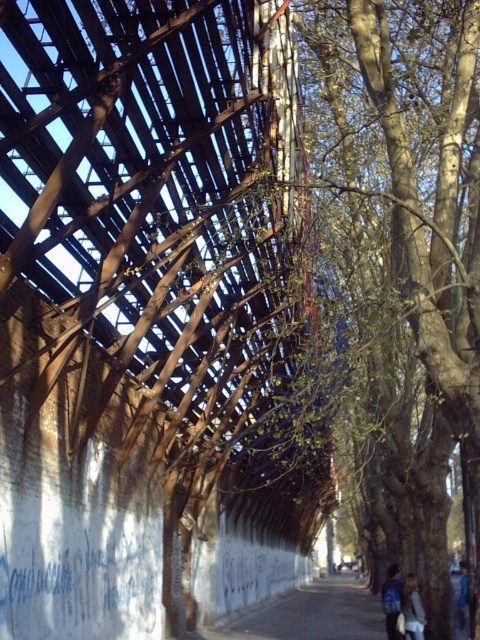
You are a painter standing at the center of the pathway. You want to paint the green leafy tree at right and the light brown leather jacket at lower right. Which object should you move closer to if you want to capture more details of the tree in your painting?

The green leafy tree at right might be wider than the light brown leather jacket at lower right, so to capture more details of the tree, you should move closer to the green leafy tree at right.

You are standing in front of the dilapidated structure and want to determine the relative positions of two points marked on the image. Which point is closer to you, point (392,115) or point (400,600)?

Point (392,115) is closer to the camera than point (400,600).

You are a hiker who just finished a long hike and is standing at the center of the pathway. You see the green leafy tree at right and the blue fabric backpack at center. Which object is closer to your right side?

The green leafy tree at right is positioned on the left side of blue fabric backpack at center, so the blue fabric backpack at center is closer to your right side.